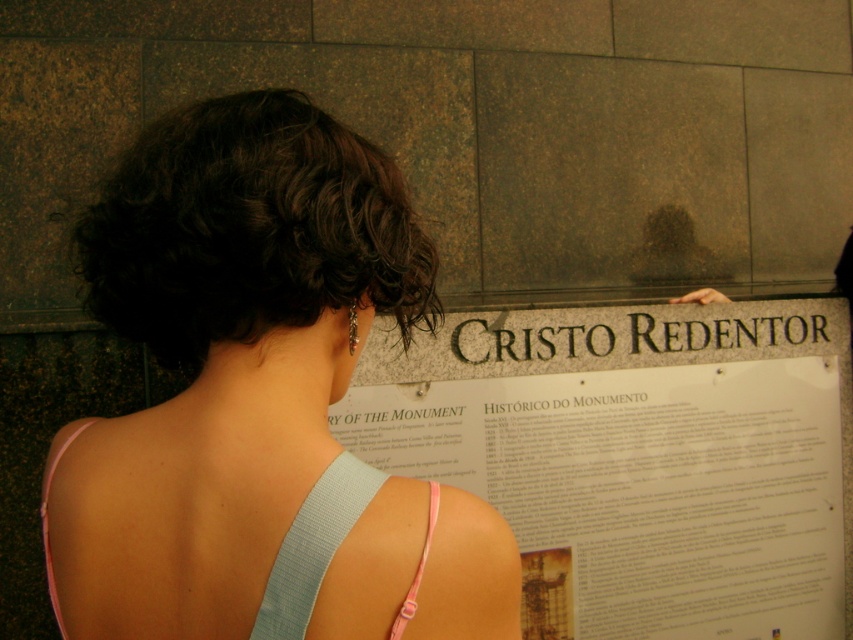
You are an event planner trying to place a decorative banner on the wall near the light blue fabric dress at center. Based on the coordinates provided, where should you position the banner relative to the dress?

The light blue fabric dress at center is located at point 0.853 on the x and 0.368 on the y axis. To place the banner near it, position the banner at coordinates close to these values on the wall.